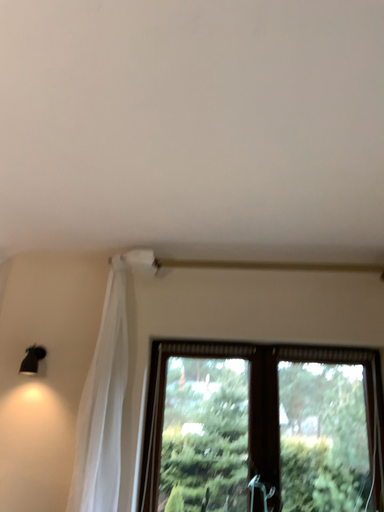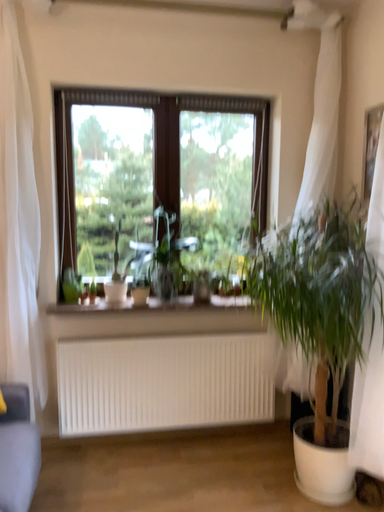
Question: Which way did the camera rotate in the video?

Choices:
 (A) rotated right
 (B) rotated left

Answer: (A)